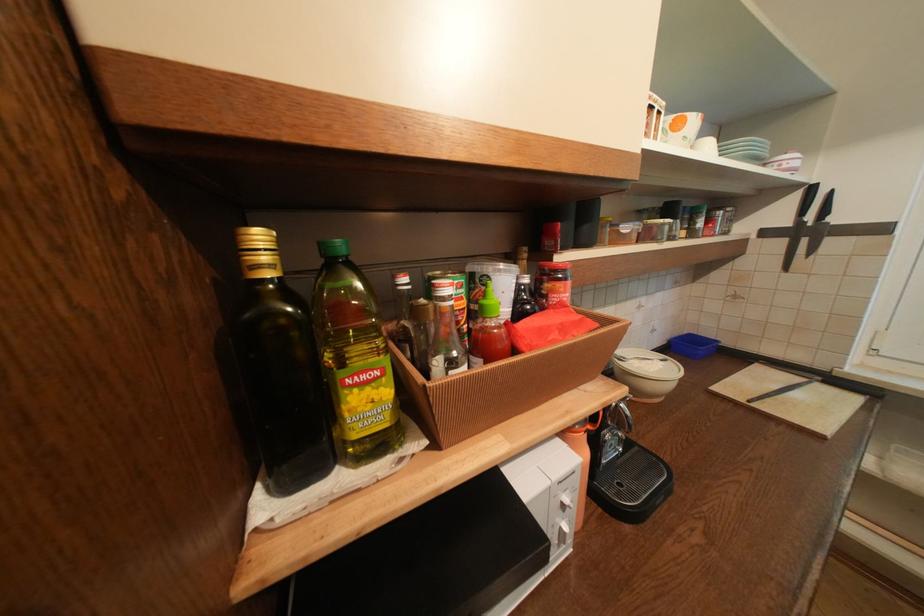
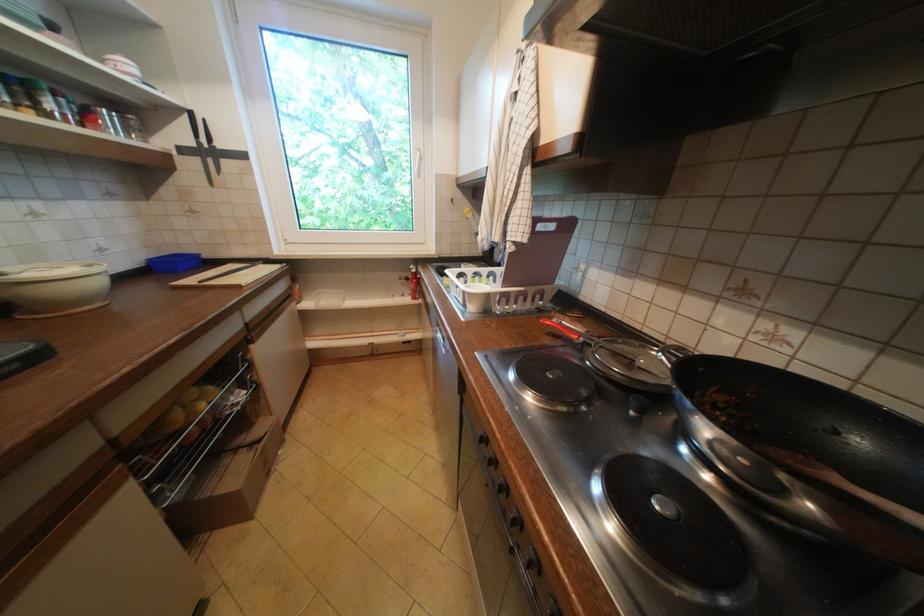
Locate, in the second image, the point that corresponds to pixel 825 379 in the first image.

(270, 262)